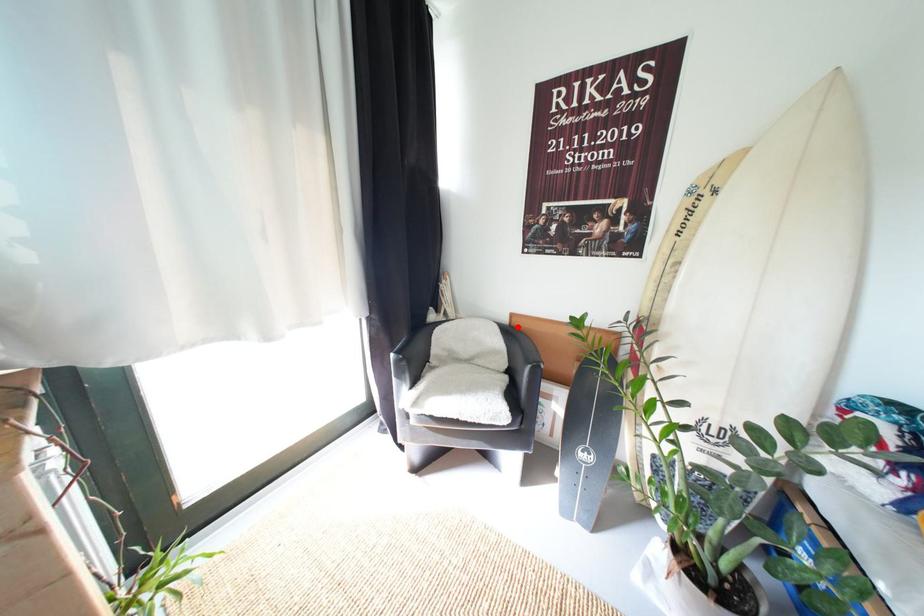
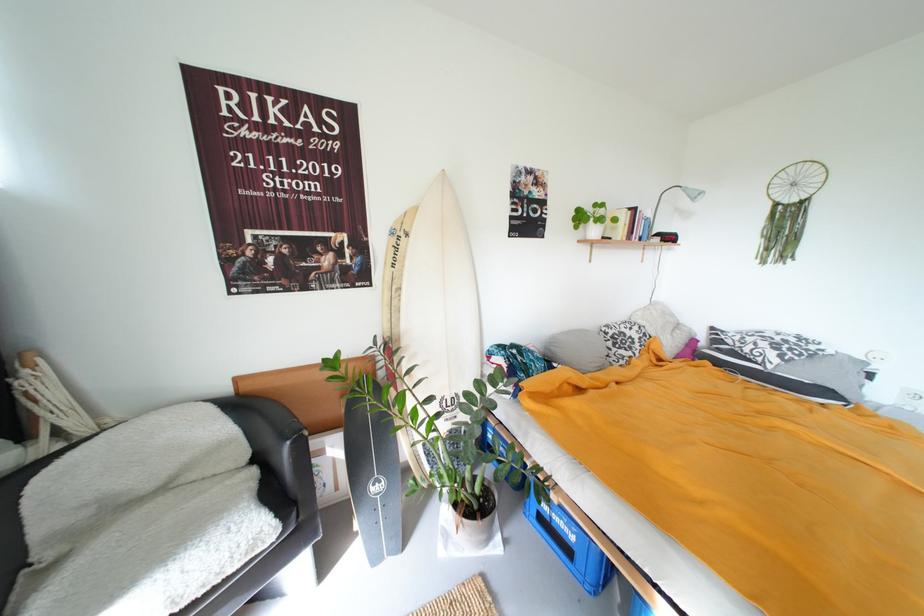
Locate, in the second image, the point that corresponds to the highlighted location in the first image.

(246, 395)